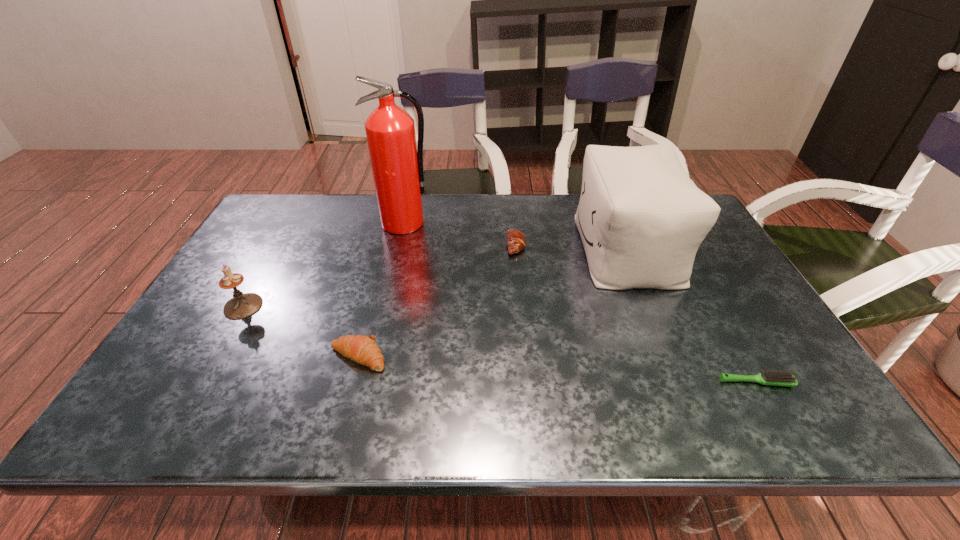
The width and height of the screenshot is (960, 540). What are the coordinates of `object that is the third closest to the nearer crescent roll` in the screenshot? It's located at (516, 241).

Identify the location of vacant space that satisfies the following two spatial constraints: 1. on the side of the fifth shortest object with the smiley face; 2. on the right side of the shortest object. coord(682,383).

Image resolution: width=960 pixels, height=540 pixels. In order to click on vacant space that satisfies the following two spatial constraints: 1. on the front side of the candle holder; 2. on the left side of the hairbrush in this screenshot , I will do `click(200, 383)`.

Find the location of a particular element. free spot that satisfies the following two spatial constraints: 1. on the back side of the candle holder; 2. on the right side of the fourth object from left to right is located at coordinates (278, 245).

Image resolution: width=960 pixels, height=540 pixels. Identify the location of vacant space that satisfies the following two spatial constraints: 1. at the nozzle of the tallest object; 2. on the right side of the farther crescent roll. (399, 245).

Where is `vacant area in the image that satisfies the following two spatial constraints: 1. on the side of the second tallest object with the smiley face; 2. on the left side of the hairbrush`? Image resolution: width=960 pixels, height=540 pixels. vacant area in the image that satisfies the following two spatial constraints: 1. on the side of the second tallest object with the smiley face; 2. on the left side of the hairbrush is located at coordinates (682, 383).